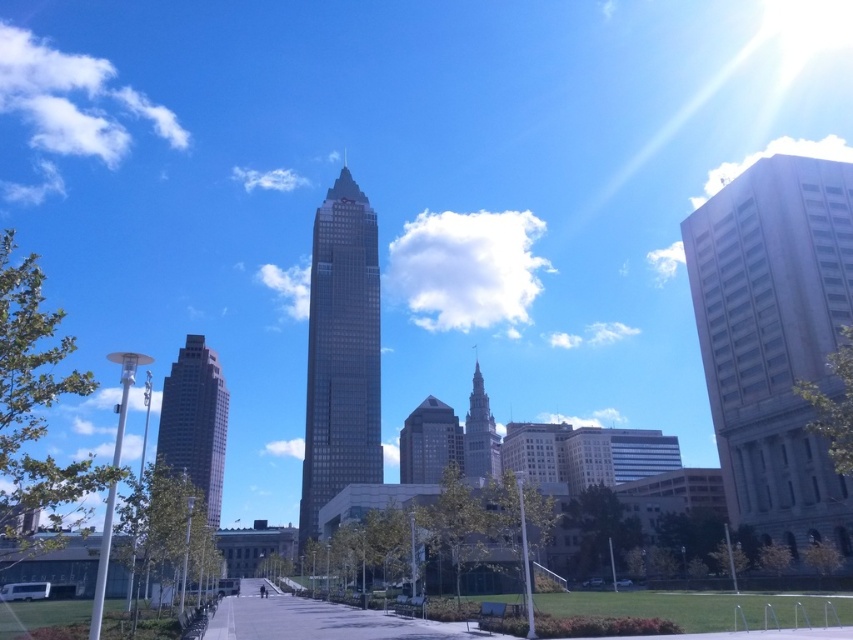
The image size is (853, 640). I want to click on gray concrete pavement at center, so click(x=321, y=620).

Does point (354, 637) come behind point (404, 464)?

No, (354, 637) is in front of (404, 464).

Find the location of a particular element. gray concrete pavement at center is located at coordinates (321, 620).

Does dark brown glass skyscraper at center appear on the left side of matte glass skyscraper at center?

Yes, dark brown glass skyscraper at center is to the left of matte glass skyscraper at center.

Who is shorter, dark brown glass skyscraper at center or matte glass skyscraper at center?

matte glass skyscraper at center

Locate an element on the screen. dark brown glass skyscraper at center is located at coordinates (341, 353).

Who is more forward, (216, 616) or (471, 444)?

Point (216, 616) is more forward.

Is point (315, 636) less distant than point (466, 458)?

That is True.

Image resolution: width=853 pixels, height=640 pixels. What are the coordinates of `gray concrete pavement at center` in the screenshot? It's located at (321, 620).